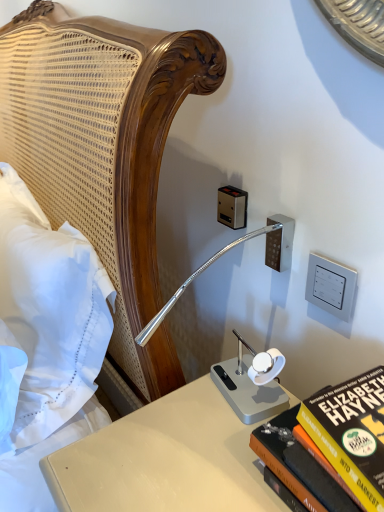
Question: Is metallic silver outlet at upper center, which ranks as the second electric outlet in bottom-to-top order, aimed at white cotton pillow at left?

Choices:
 (A) no
 (B) yes

Answer: (B)

Question: Is metallic silver outlet at upper center, which ranks as the second electric outlet in bottom-to-top order, looking in the opposite direction of white cotton pillow at left?

Choices:
 (A) yes
 (B) no

Answer: (B)

Question: Does metallic silver outlet at upper center, arranged as the first electric outlet when viewed from the top, have a greater height compared to white cotton pillow at left?

Choices:
 (A) no
 (B) yes

Answer: (A)

Question: Would you say white cotton pillow at left is part of metallic silver outlet at upper center, arranged as the first electric outlet when viewed from the top,'s contents?

Choices:
 (A) no
 (B) yes

Answer: (A)

Question: Can you confirm if metallic silver outlet at upper center, acting as the first electric outlet starting from the left, is positioned to the left of white cotton pillow at left?

Choices:
 (A) yes
 (B) no

Answer: (B)

Question: Considering the positions of hardcover book at lower right and white plastic switch at upper right, the first electric outlet positioned from the front, in the image, is hardcover book at lower right wider or thinner than white plastic switch at upper right, the first electric outlet positioned from the front,?

Choices:
 (A) thin
 (B) wide

Answer: (B)

Question: In terms of height, does hardcover book at lower right look taller or shorter compared to white plastic switch at upper right, which ranks as the 2th electric outlet in back-to-front order?

Choices:
 (A) tall
 (B) short

Answer: (A)

Question: Which is correct: hardcover book at lower right is inside white plastic switch at upper right, positioned as the second electric outlet in left-to-right order, or outside of it?

Choices:
 (A) inside
 (B) outside

Answer: (B)

Question: From a real-world perspective, is hardcover book at lower right above or below white plastic switch at upper right, which ranks as the first electric outlet in bottom-to-top order?

Choices:
 (A) below
 (B) above

Answer: (A)

Question: From a real-world perspective, is white cotton pillow at left above or below white plastic switch at upper right, positioned as the second electric outlet in left-to-right order?

Choices:
 (A) below
 (B) above

Answer: (A)

Question: In the image, is white cotton pillow at left positioned in front of or behind white plastic switch at upper right, which ranks as the 2th electric outlet in back-to-front order?

Choices:
 (A) behind
 (B) front

Answer: (B)

Question: From the image's perspective, is white cotton pillow at left located above or below white plastic switch at upper right, the first electric outlet positioned from the front?

Choices:
 (A) below
 (B) above

Answer: (A)

Question: Would you say white cotton pillow at left is inside or outside white plastic switch at upper right, which ranks as the 2th electric outlet in back-to-front order?

Choices:
 (A) inside
 (B) outside

Answer: (B)

Question: Considering the positions of white plastic switch at upper right, which ranks as the 2th electric outlet in back-to-front order, and white cotton pillow at left in the image, is white plastic switch at upper right, which ranks as the 2th electric outlet in back-to-front order, wider or thinner than white cotton pillow at left?

Choices:
 (A) wide
 (B) thin

Answer: (B)

Question: Is white plastic switch at upper right, acting as the second electric outlet starting from the top, spatially inside white cotton pillow at left, or outside of it?

Choices:
 (A) outside
 (B) inside

Answer: (A)